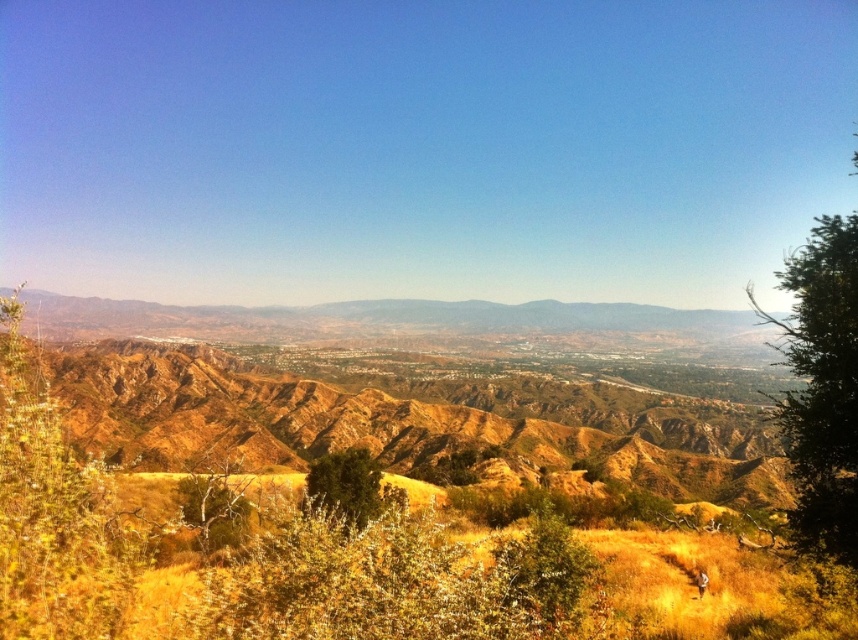
Question: Does green leafy shrub at lower left have a lesser width compared to green leafy tree at center?

Choices:
 (A) no
 (B) yes

Answer: (A)

Question: Which object is farther from the camera taking this photo?

Choices:
 (A) green leafy shrub at lower left
 (B) green matte tree at center
 (C) brown textured mountains at center

Answer: (C)

Question: Among these points, which one is farthest from the camera?

Choices:
 (A) (10, 612)
 (B) (222, 531)
 (C) (850, 236)

Answer: (B)

Question: Can you confirm if green leafy tree at right is positioned to the right of brown textured tree at lower left?

Choices:
 (A) yes
 (B) no

Answer: (A)

Question: Where is green leafy tree at right located in relation to green matte tree at center in the image?

Choices:
 (A) below
 (B) above

Answer: (B)

Question: Which object is the closest to the brown textured mountains at center?

Choices:
 (A) green matte tree at center
 (B) green leafy tree at right
 (C) green leafy shrub at lower left
 (D) brown textured tree at lower left

Answer: (B)